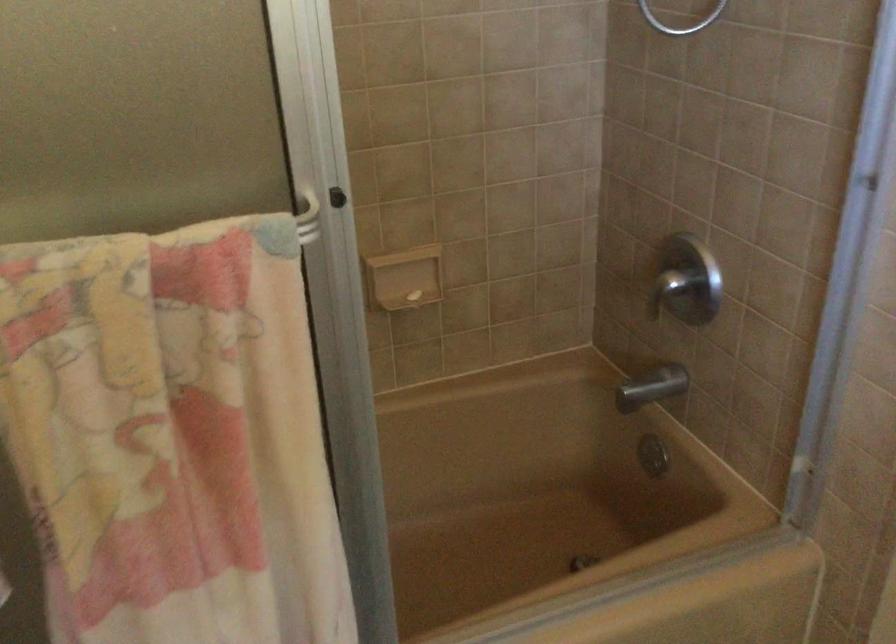
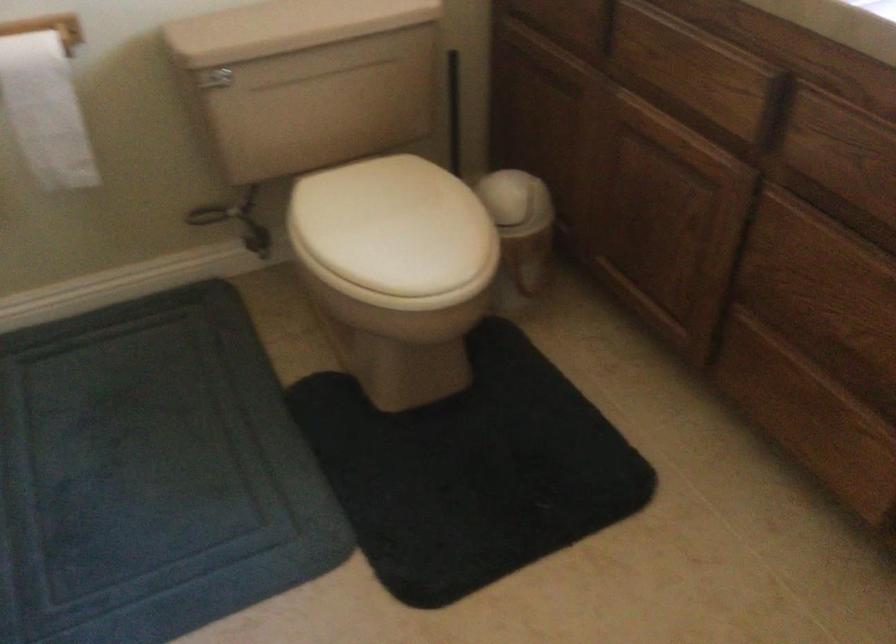
Based on the continuous images, in which direction is the camera rotating?

The camera rotated toward right-down.